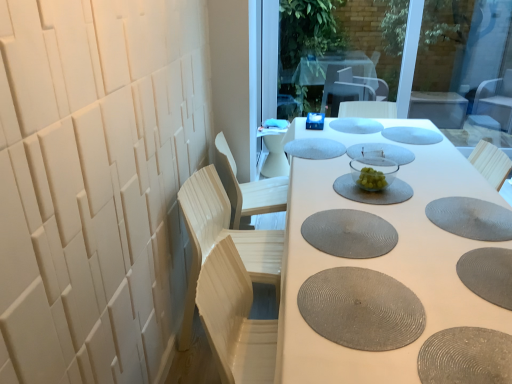
What are the coordinates of `vacant space that is to the left of clear glass bowl at center, the sixth manhole cover positioned from the front` in the screenshot? It's located at (311, 188).